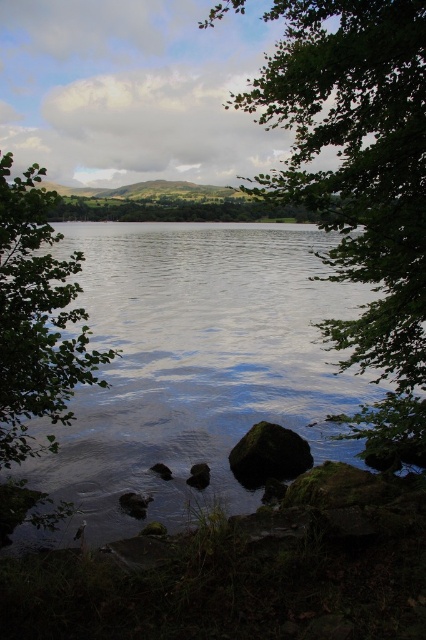
Question: Is clear water at center thinner than green leafy tree at center?

Choices:
 (A) no
 (B) yes

Answer: (A)

Question: Is clear water at center smaller than green leafy tree at center?

Choices:
 (A) yes
 (B) no

Answer: (A)

Question: Does green leafy tree at center appear over green mossy rock at lower center?

Choices:
 (A) yes
 (B) no

Answer: (A)

Question: Which of these objects is positioned closest to the clear water at center?

Choices:
 (A) green leafy tree at left
 (B) green mossy rock at lower center
 (C) green leafy tree at center

Answer: (B)

Question: Which point appears farthest from the camera in this image?

Choices:
 (A) (5, 157)
 (B) (405, 209)
 (C) (261, 454)

Answer: (C)

Question: Estimate the real-world distances between objects in this image. Which object is farther from the green mossy rock at lower center?

Choices:
 (A) green leafy tree at left
 (B) green leafy tree at center
 (C) clear water at center

Answer: (B)